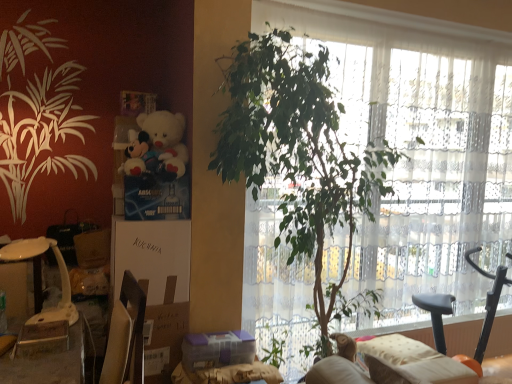
Where is `white plastic table at lower left`? The image size is (512, 384). white plastic table at lower left is located at coordinates (29, 258).

This screenshot has height=384, width=512. Describe the element at coordinates (156, 285) in the screenshot. I see `white cardboard box at center-left, marked as the 1th cardboard box in a top-to-bottom arrangement` at that location.

Image resolution: width=512 pixels, height=384 pixels. Find the location of `brown cardboard box at lower left, the first cardboard box from the bottom`. brown cardboard box at lower left, the first cardboard box from the bottom is located at coordinates (164, 340).

This screenshot has width=512, height=384. What are the coordinates of `transparent glass window at center` in the screenshot? It's located at (421, 151).

Where is `white plush toy at upper left`? The width and height of the screenshot is (512, 384). white plush toy at upper left is located at coordinates (156, 147).

This screenshot has height=384, width=512. I want to click on green leafy plant at center, so (300, 160).

Considering the relative sizes of brown cardboard box at lower left, placed as the 2th cardboard box when sorted from top to bottom, and white plastic table at lower left in the image provided, is brown cardboard box at lower left, placed as the 2th cardboard box when sorted from top to bottom, wider than white plastic table at lower left?

Correct, the width of brown cardboard box at lower left, placed as the 2th cardboard box when sorted from top to bottom, exceeds that of white plastic table at lower left.

Does point (178, 326) come behind point (37, 289)?

No, it is in front of (37, 289).

Which is more to the right, brown cardboard box at lower left, the first cardboard box from the bottom, or white plastic table at lower left?

brown cardboard box at lower left, the first cardboard box from the bottom, is more to the right.

Is brown cardboard box at lower left, placed as the 2th cardboard box when sorted from top to bottom, placed right next to white plastic table at lower left?

There is a gap between brown cardboard box at lower left, placed as the 2th cardboard box when sorted from top to bottom, and white plastic table at lower left.

Does brown cardboard box at lower left, placed as the 2th cardboard box when sorted from top to bottom, turn towards white plush toy at upper left?

No, brown cardboard box at lower left, placed as the 2th cardboard box when sorted from top to bottom, is not aimed at white plush toy at upper left.

From the image's perspective, is brown cardboard box at lower left, the first cardboard box from the bottom, below white plush toy at upper left?

Yes.

Is brown cardboard box at lower left, placed as the 2th cardboard box when sorted from top to bottom, completely or partially outside of white plush toy at upper left?

Absolutely, brown cardboard box at lower left, placed as the 2th cardboard box when sorted from top to bottom, is external to white plush toy at upper left.

Based on the photo, is the surface of white cardboard box at center-left, marked as the 1th cardboard box in a top-to-bottom arrangement, in direct contact with green leafy plant at center?

They are not placed beside each other.

Is white cardboard box at center-left, which is the second cardboard box in bottom-to-top order, taller than green leafy plant at center?

No.

Can you tell me how much white cardboard box at center-left, marked as the 1th cardboard box in a top-to-bottom arrangement, and green leafy plant at center differ in facing direction?

There is a 91.6-degree angle between the facing directions of white cardboard box at center-left, marked as the 1th cardboard box in a top-to-bottom arrangement, and green leafy plant at center.

In the scene shown: Does white cardboard box at center-left, marked as the 1th cardboard box in a top-to-bottom arrangement, have a smaller size compared to green leafy plant at center?

Yes, white cardboard box at center-left, marked as the 1th cardboard box in a top-to-bottom arrangement, is smaller than green leafy plant at center.

Identify the location of couch behind the white plush toy at upper left. (392, 365).

Is beige fabric couch at lower right a part of white plush toy at upper left?

No, beige fabric couch at lower right is not inside white plush toy at upper left.

Does white plush toy at upper left have a lesser height compared to beige fabric couch at lower right?

No, white plush toy at upper left is not shorter than beige fabric couch at lower right.

Is there a large distance between beige fabric couch at lower right and green leafy plant at center?

beige fabric couch at lower right is actually quite close to green leafy plant at center.

How many degrees apart are the facing directions of beige fabric couch at lower right and green leafy plant at center?

beige fabric couch at lower right and green leafy plant at center are facing 4.99 degrees away from each other.

Based on the photo, from the image's perspective, who appears lower, beige fabric couch at lower right or green leafy plant at center?

beige fabric couch at lower right, from the image's perspective.

In terms of size, does beige fabric couch at lower right appear bigger or smaller than green leafy plant at center?

Considering their sizes, beige fabric couch at lower right takes up less space than green leafy plant at center.

Locate an element on the screen. This screenshot has height=384, width=512. couch below the white cardboard box at center-left, marked as the 1th cardboard box in a top-to-bottom arrangement (from the image's perspective) is located at coordinates (392, 365).

Would you say beige fabric couch at lower right is to the left or to the right of white cardboard box at center-left, which is the second cardboard box in bottom-to-top order, in the picture?

Clearly, beige fabric couch at lower right is on the right of white cardboard box at center-left, which is the second cardboard box in bottom-to-top order, in the image.

Which object is wider, beige fabric couch at lower right or white cardboard box at center-left, marked as the 1th cardboard box in a top-to-bottom arrangement?

beige fabric couch at lower right is wider.

From the image's perspective, is beige fabric couch at lower right above or below white cardboard box at center-left, marked as the 1th cardboard box in a top-to-bottom arrangement?

Clearly, from the image's perspective, beige fabric couch at lower right is below white cardboard box at center-left, marked as the 1th cardboard box in a top-to-bottom arrangement.

Between beige fabric couch at lower right and brown cardboard box at lower left, the first cardboard box from the bottom, which one has smaller width?

brown cardboard box at lower left, the first cardboard box from the bottom, is thinner.

Does beige fabric couch at lower right have a greater height compared to brown cardboard box at lower left, placed as the 2th cardboard box when sorted from top to bottom?

Incorrect, the height of beige fabric couch at lower right is not larger of that of brown cardboard box at lower left, placed as the 2th cardboard box when sorted from top to bottom.

Is beige fabric couch at lower right closer to camera compared to brown cardboard box at lower left, placed as the 2th cardboard box when sorted from top to bottom?

That is False.

From the beige fabric couch at lower right, count the 1st cardboard box to the left and point to it. Please provide its 2D coordinates.

[(164, 340)]

This screenshot has height=384, width=512. In order to click on cardboard box that appears below the white plastic table at lower left (from a real-world perspective) in this screenshot , I will do click(x=164, y=340).

Identify the location of the 2nd cardboard box below the white plush toy at upper left (from the image's perspective). The width and height of the screenshot is (512, 384). (164, 340).

When comparing their distances from green leafy plant at center, does white cardboard box at center-left, marked as the 1th cardboard box in a top-to-bottom arrangement, or beige fabric couch at lower right seem further?

beige fabric couch at lower right is further to green leafy plant at center.

From the image, which object appears to be nearer to beige fabric couch at lower right, white plush toy at upper left or green leafy plant at center?

Among the two, green leafy plant at center is located nearer to beige fabric couch at lower right.

Which object lies nearer to the anchor point brown cardboard box at lower left, placed as the 2th cardboard box when sorted from top to bottom, white cardboard box at center-left, marked as the 1th cardboard box in a top-to-bottom arrangement, or white plush toy at upper left?

The object closer to brown cardboard box at lower left, placed as the 2th cardboard box when sorted from top to bottom, is white cardboard box at center-left, marked as the 1th cardboard box in a top-to-bottom arrangement.

When comparing their distances from transparent glass window at center, does white plush toy at upper left or white plastic table at lower left seem closer?

white plush toy at upper left lies closer to transparent glass window at center than the other object.

Estimate the real-world distances between objects in this image. Which object is further from brown cardboard box at lower left, the first cardboard box from the bottom, transparent glass window at center or beige fabric couch at lower right?

transparent glass window at center is further to brown cardboard box at lower left, the first cardboard box from the bottom.

Considering their positions, is white cardboard box at center-left, which is the second cardboard box in bottom-to-top order, positioned further to transparent glass window at center than white plastic table at lower left?

white plastic table at lower left is positioned further to the anchor transparent glass window at center.

Estimate the real-world distances between objects in this image. Which object is closer to white cardboard box at center-left, which is the second cardboard box in bottom-to-top order, beige fabric couch at lower right or white plush toy at upper left?

The object closer to white cardboard box at center-left, which is the second cardboard box in bottom-to-top order, is white plush toy at upper left.

Based on the photo, considering their positions, is white cardboard box at center-left, marked as the 1th cardboard box in a top-to-bottom arrangement, positioned further to white plush toy at upper left than transparent glass window at center?

transparent glass window at center is positioned further to the anchor white plush toy at upper left.

Find the location of a particular element. houseplant situated between brown cardboard box at lower left, placed as the 2th cardboard box when sorted from top to bottom, and transparent glass window at center from left to right is located at coordinates (300, 160).

Locate an element on the screen. This screenshot has width=512, height=384. table between white plush toy at upper left and brown cardboard box at lower left, the first cardboard box from the bottom, in the up-down direction is located at coordinates (29, 258).

You are a GUI agent. You are given a task and a screenshot of the screen. Output one action in this format:
    pyautogui.click(x=<x>, y=<y>)
    Task: Click on the toy between white cardboard box at center-left, marked as the 1th cardboard box in a top-to-bottom arrangement, and beige fabric couch at lower right
    
    Given the screenshot: What is the action you would take?
    pyautogui.click(x=156, y=147)

Where is `cardboard box between white cardboard box at center-left, which is the second cardboard box in bottom-to-top order, and beige fabric couch at lower right, in the horizontal direction`? cardboard box between white cardboard box at center-left, which is the second cardboard box in bottom-to-top order, and beige fabric couch at lower right, in the horizontal direction is located at coordinates (164, 340).